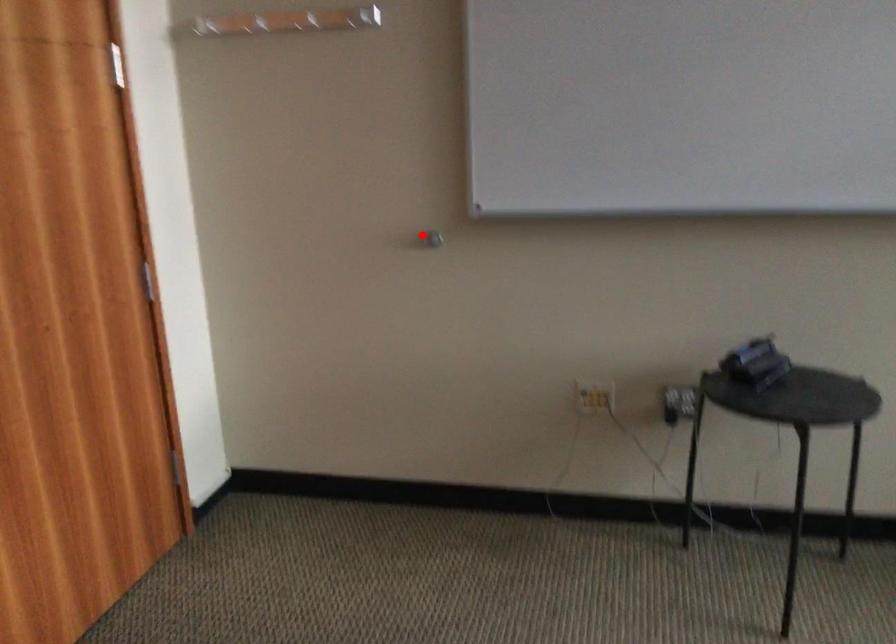
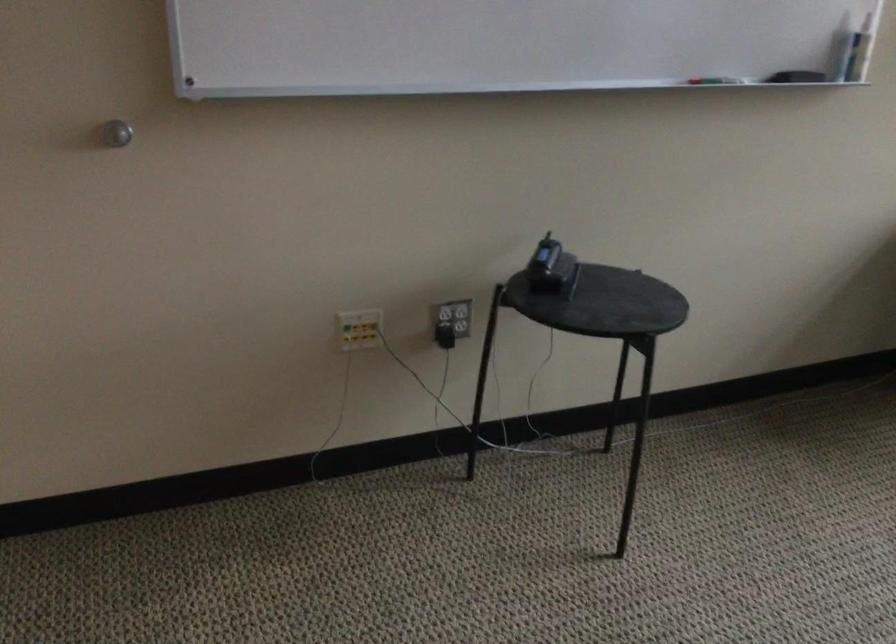
Where in the second image is the point corresponding to the highlighted location from the first image?

(116, 133)